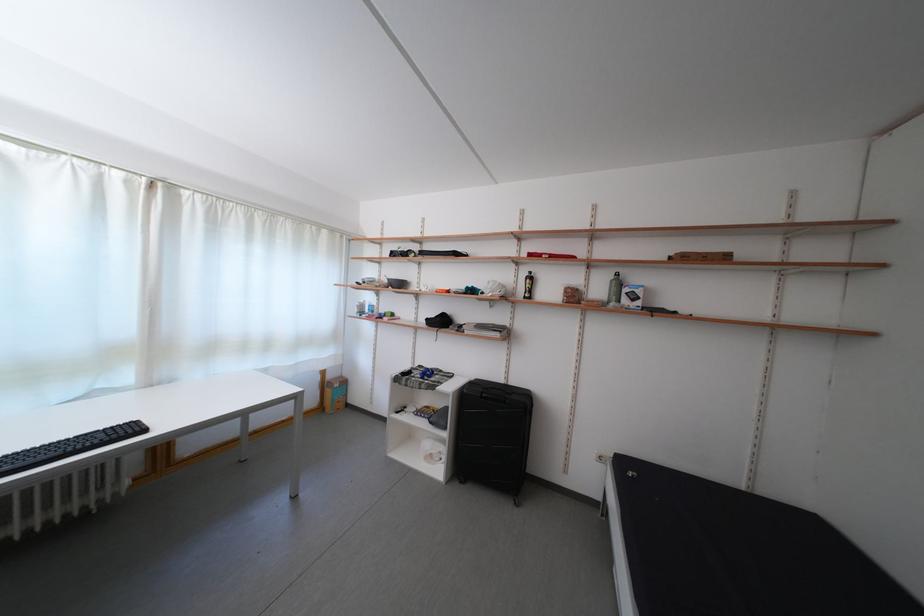
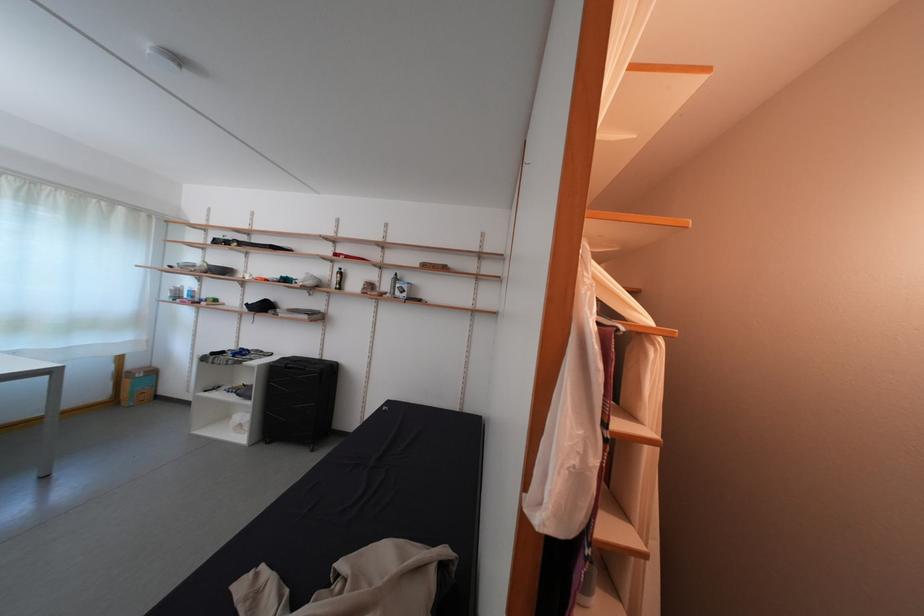
In the second image, find the point that corresponds to point 525,294 in the first image.

(339, 286)